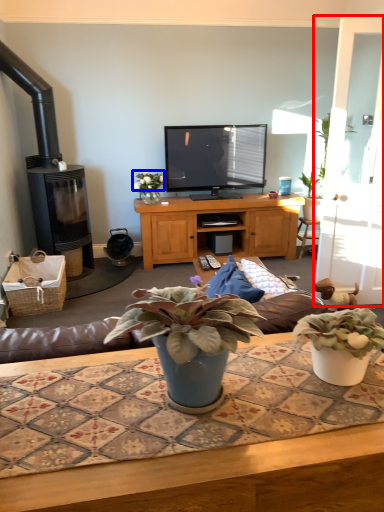
Question: Which object is further to the camera taking this photo, glass door (highlighted by a red box) or flower (highlighted by a blue box)?

Choices:
 (A) glass door
 (B) flower

Answer: (B)